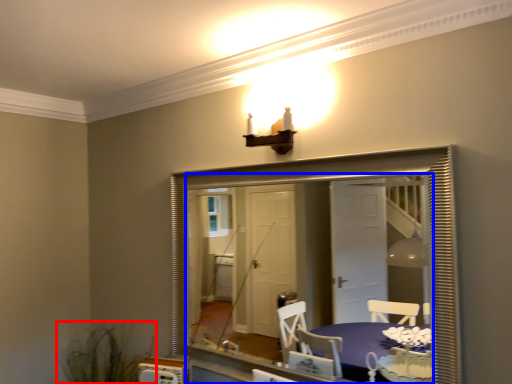
Question: Which of the following is the farthest to the observer, plant (highlighted by a red box) or mirror (highlighted by a blue box)?

Choices:
 (A) plant
 (B) mirror

Answer: (A)